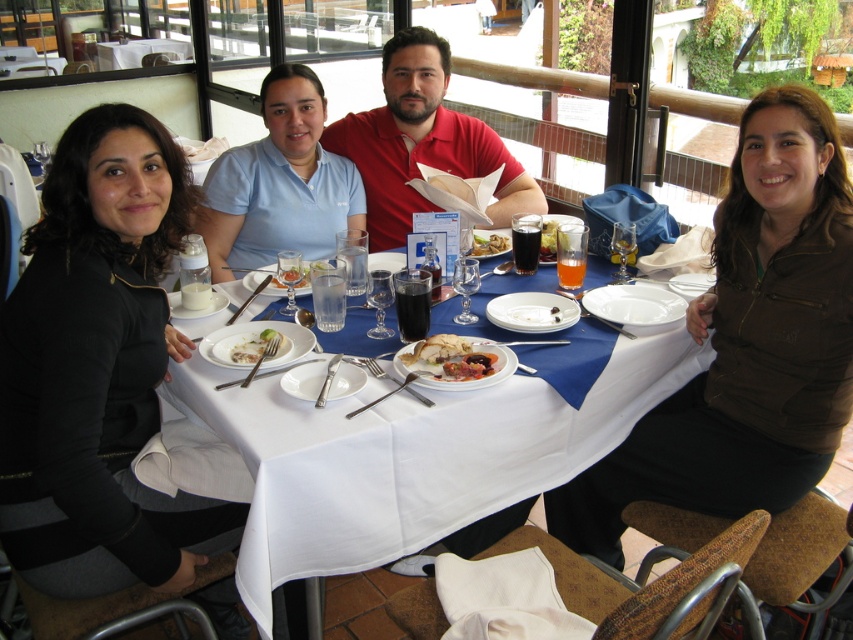
Question: Which of the following is the farthest from the observer?

Choices:
 (A) (474, 248)
 (B) (546, 237)

Answer: (A)

Question: Does white glossy plate at center have a greater width compared to translucent glass beverage at center?

Choices:
 (A) no
 (B) yes

Answer: (B)

Question: In this image, where is brown matte jacket at center located relative to golden brown crispy chicken at center?

Choices:
 (A) left
 (B) right

Answer: (B)

Question: Which point is farther to the camera?

Choices:
 (A) (126, 52)
 (B) (373, 131)
 (C) (253, 353)

Answer: (A)

Question: Is light blue polo shirt at center wider than golden brown crispy chicken at center?

Choices:
 (A) yes
 (B) no

Answer: (A)

Question: Which object appears closest to the camera in this image?

Choices:
 (A) white glossy table at center
 (B) white cloth table at center
 (C) light blue polo shirt at center
 (D) black matte jacket at left

Answer: (D)